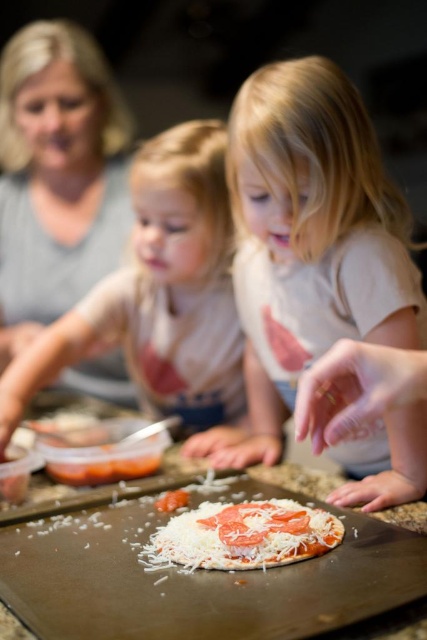
Is white matte pizza at center thinner than white cotton shirt at center?

Yes.

From the picture: Who is positioned more to the right, white matte pizza at center or white cotton shirt at center?

From the viewer's perspective, white matte pizza at center appears more on the right side.

At what (x,y) coordinates should I click in order to perform the action: click on white matte pizza at center. Please return your answer as a coordinate pair (x, y). Looking at the image, I should click on (310, 237).

Can you confirm if white cotton shirt at center is thinner than white cheese pizza at center?

No, white cotton shirt at center is not thinner than white cheese pizza at center.

Which is in front, point (155, 148) or point (228, 525)?

Point (228, 525)

This screenshot has width=427, height=640. In order to click on white cotton shirt at center in this screenshot , I will do `click(160, 300)`.

Identify the location of white cotton shirt at center. This screenshot has height=640, width=427. (160, 300).

Can you confirm if white matte pizza at center is positioned to the right of matte gray shirt at upper left?

Correct, you'll find white matte pizza at center to the right of matte gray shirt at upper left.

Who is higher up, white matte pizza at center or matte gray shirt at upper left?

Positioned higher is matte gray shirt at upper left.

Where is `white matte pizza at center`? The width and height of the screenshot is (427, 640). white matte pizza at center is located at coordinates (310, 237).

You are a GUI agent. You are given a task and a screenshot of the screen. Output one action in this format:
    pyautogui.click(x=<x>, y=<y>)
    Task: Click on the white matte pizza at center
    The height and width of the screenshot is (640, 427).
    Given the screenshot: What is the action you would take?
    pyautogui.click(x=310, y=237)